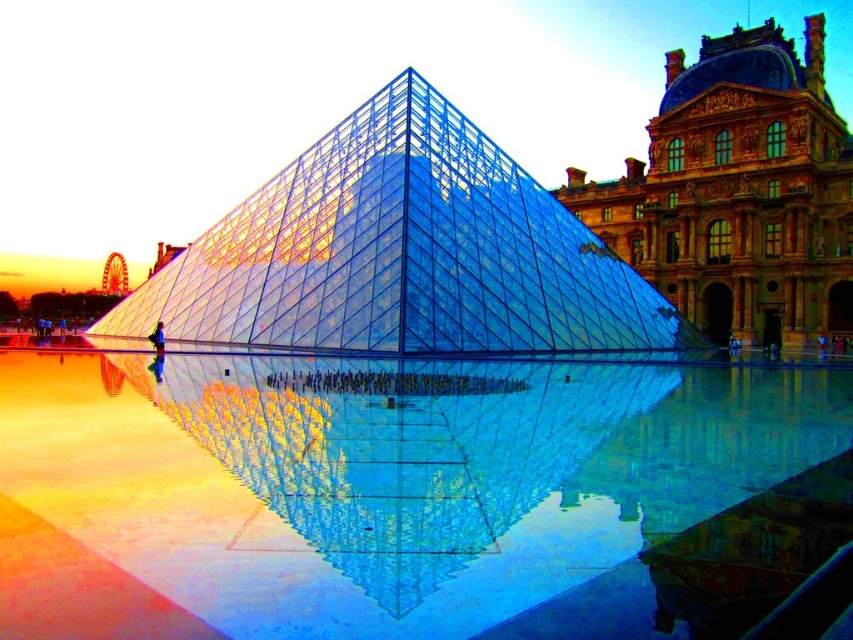
You are standing in front of the Louvre Pyramid and want to take a photo of both the transparent glass pool at center and the marble stone palace at upper right. Which object should you position lower in your camera frame to include both in the photo?

You should position the transparent glass pool at center lower in your camera frame because it is located below the marble stone palace at upper right.

You are an architect visiting the Louvre Museum. You want to take a photo of the transparent glass pyramid at center and the marble stone palace at upper right. Which object should you focus on first if you want to capture the entire scene without moving your camera? Explain your reasoning based on their sizes in the image.

The transparent glass pyramid at center should be focused on first because it occupies less space than the marble stone palace at upper right. Since the pyramid is smaller, capturing its details while still including the larger palace in the background would require focusing on the smaller object to ensure both fit within the frame.